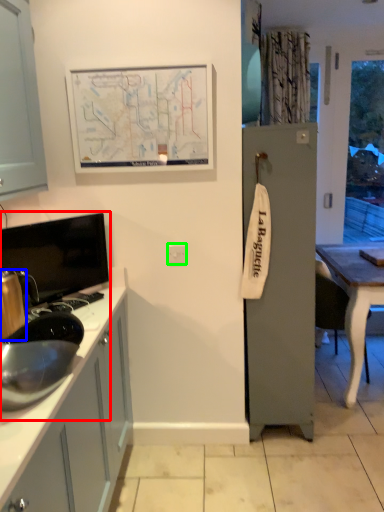
Question: Based on their relative distances, which object is nearer to sink (highlighted by a red box)? Choose from appliance (highlighted by a blue box) and electric outlet (highlighted by a green box).

Choices:
 (A) appliance
 (B) electric outlet

Answer: (A)